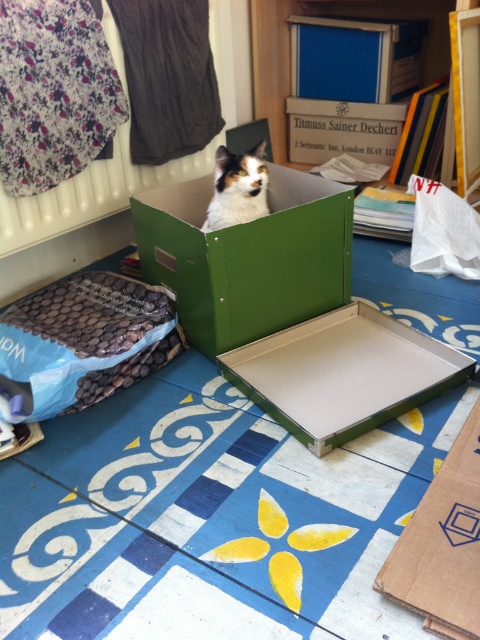
You are standing in the room and want to place a small toy inside the green cardboard box at center. Based on the coordinates provided, can you determine if the point marked at (248, 257) is the correct location for the box?

Yes, the point marked at (248, 257) corresponds to the green cardboard box at center, as stated in the description.

You are standing in the room and want to take a photo of the cat in the green cardboard box. There are two points marked in the image at coordinates point (x=471, y=477) and point (x=224, y=172). Which point should you focus on to ensure the cat is in sharp focus?

You should focus on point (x=471, y=477) because it is closer to the camera than point (x=224, y=172), and the cat is located near that point.